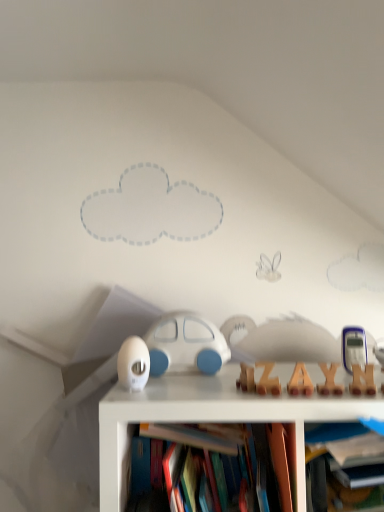
Question: Is hardcover book at center bigger than wooden letter at center, the third toy positioned from the left?

Choices:
 (A) no
 (B) yes

Answer: (B)

Question: From a real-world perspective, is hardcover book at center on top of wooden letter at center, which ranks as the 1th toy in right-to-left order?

Choices:
 (A) no
 (B) yes

Answer: (A)

Question: Is there a large distance between hardcover book at center and wooden letter at center, which ranks as the 1th toy in right-to-left order?

Choices:
 (A) yes
 (B) no

Answer: (B)

Question: Is hardcover book at center oriented towards wooden letter at center, which ranks as the 1th toy in right-to-left order?

Choices:
 (A) yes
 (B) no

Answer: (B)

Question: Is hardcover book at center at the right side of wooden letter at center, which ranks as the 1th toy in right-to-left order?

Choices:
 (A) no
 (B) yes

Answer: (A)

Question: Considering the positions of white matte egg at center, the first toy viewed from the left, and wooden letter at center, the 3th toy in the back-to-front sequence, in the image, is white matte egg at center, the first toy viewed from the left, bigger or smaller than wooden letter at center, the 3th toy in the back-to-front sequence,?

Choices:
 (A) big
 (B) small

Answer: (A)

Question: Considering the positions of point (147, 360) and point (342, 389), is point (147, 360) closer or farther from the camera than point (342, 389)?

Choices:
 (A) closer
 (B) farther

Answer: (B)

Question: Is white matte egg at center, which is the third toy from right to left, inside the boundaries of wooden letter at center, which ranks as the 1th toy in right-to-left order, or outside?

Choices:
 (A) inside
 (B) outside

Answer: (B)

Question: From their relative heights in the image, would you say white matte egg at center, the first toy viewed from the left, is taller or shorter than wooden letter at center, the 3th toy in the back-to-front sequence?

Choices:
 (A) short
 (B) tall

Answer: (B)

Question: From a real-world perspective, is white matte car at center, acting as the second toy starting from the right, positioned above or below wooden letter at center, the 3th toy in the back-to-front sequence?

Choices:
 (A) above
 (B) below

Answer: (A)

Question: Considering the relative positions of white matte car at center, which is the 3th toy from front to back, and wooden letter at center, which ranks as the 1th toy in right-to-left order, in the image provided, is white matte car at center, which is the 3th toy from front to back, to the left or to the right of wooden letter at center, which ranks as the 1th toy in right-to-left order,?

Choices:
 (A) right
 (B) left

Answer: (B)

Question: In terms of width, does white matte car at center, which is the 3th toy from front to back, look wider or thinner when compared to wooden letter at center, which ranks as the 1th toy in right-to-left order?

Choices:
 (A) thin
 (B) wide

Answer: (B)

Question: From the image's perspective, relative to wooden letter at center, the 3th toy in the back-to-front sequence, is white matte car at center, acting as the second toy starting from the right, above or below?

Choices:
 (A) above
 (B) below

Answer: (A)

Question: Looking at their shapes, would you say white matte egg at center, the second toy from the front, is wider or thinner than hardcover book at center?

Choices:
 (A) wide
 (B) thin

Answer: (B)

Question: From the image's perspective, is white matte egg at center, the 2th toy from the back, positioned above or below hardcover book at center?

Choices:
 (A) above
 (B) below

Answer: (A)